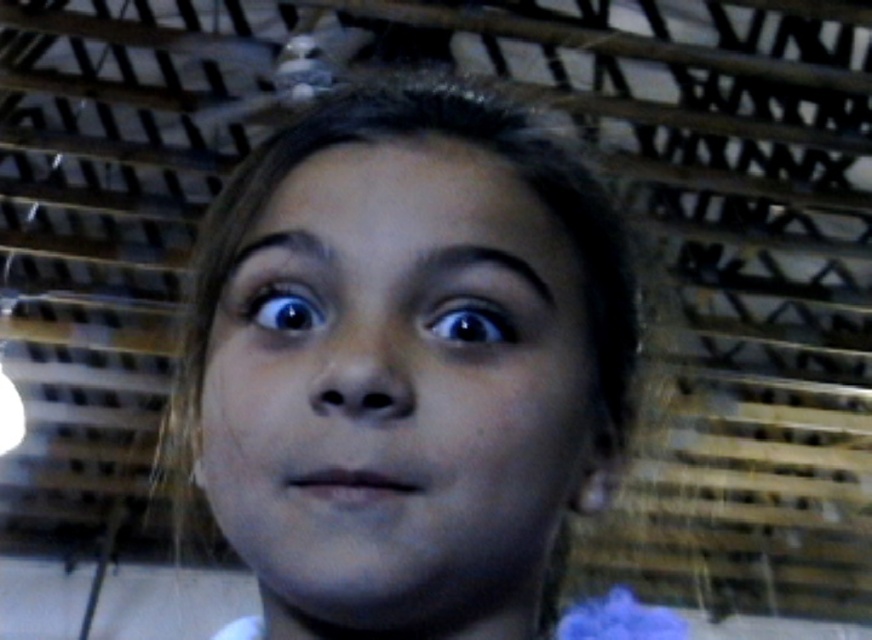
Question: Can you confirm if smooth skin face at center is thinner than blue glossy eye at center?

Choices:
 (A) no
 (B) yes

Answer: (A)

Question: Is black glossy eye at center to the right of blue glossy eye at center from the viewer's perspective?

Choices:
 (A) no
 (B) yes

Answer: (B)

Question: Where is black glossy eye at center located in relation to blue glossy eye at center in the image?

Choices:
 (A) left
 (B) right

Answer: (B)

Question: Which object is closer to the camera taking this photo?

Choices:
 (A) blue glossy eye at center
 (B) black glossy eye at center

Answer: (B)

Question: Among these objects, which one is nearest to the camera?

Choices:
 (A) blue glossy eye at center
 (B) smooth skin face at center
 (C) black glossy eye at center

Answer: (B)

Question: Estimate the real-world distances between objects in this image. Which object is farther from the black glossy eye at center?

Choices:
 (A) blue glossy eye at center
 (B) smooth skin face at center

Answer: (B)